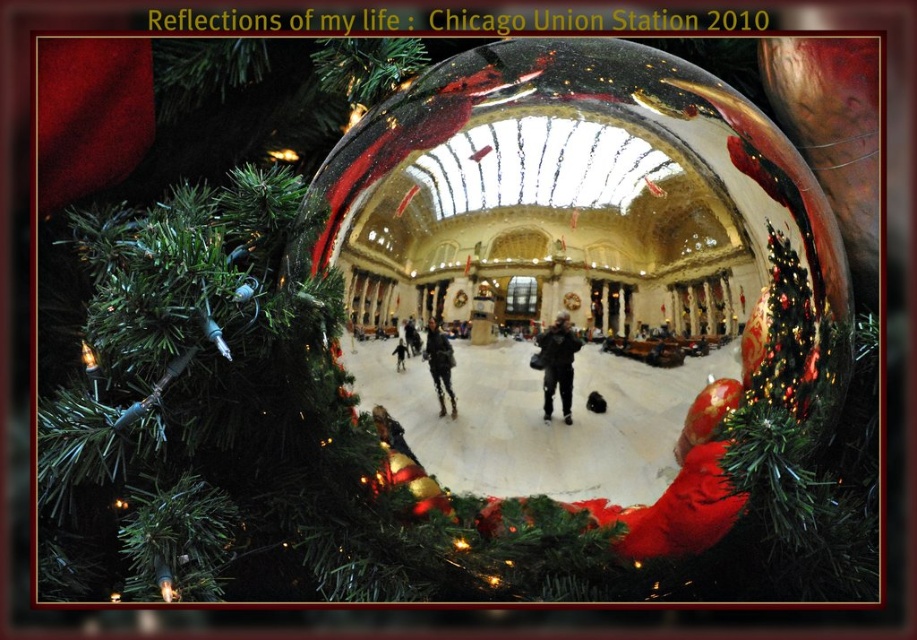
Between dark gray fabric jacket at center and matte black jacket at center, which one appears on the left side from the viewer's perspective?

Positioned to the left is matte black jacket at center.

Is dark gray fabric jacket at center thinner than matte black jacket at center?

No.

The height and width of the screenshot is (640, 917). Identify the location of dark gray fabric jacket at center. (558, 364).